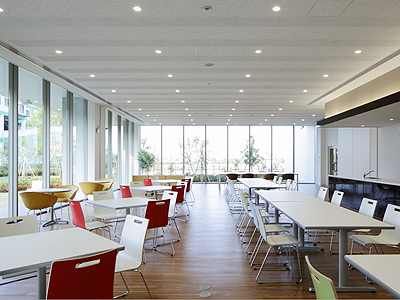
Where is `vertical metal dividers between windows panes in the back of the room`? This screenshot has width=400, height=300. vertical metal dividers between windows panes in the back of the room is located at coordinates (161, 149), (183, 149), (204, 151), (227, 150), (249, 149), (271, 150), (293, 150).